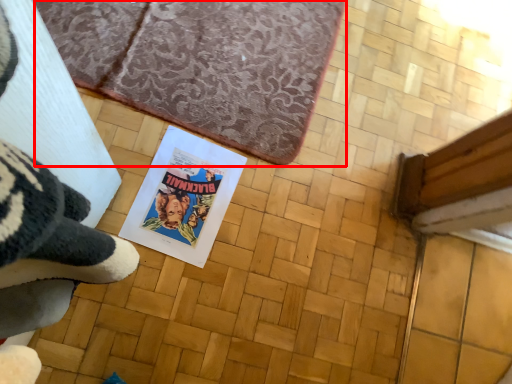
Question: From the image's perspective, what is the correct spatial relationship of bath mat (annotated by the red box) in relation to paperback book?

Choices:
 (A) above
 (B) below

Answer: (A)